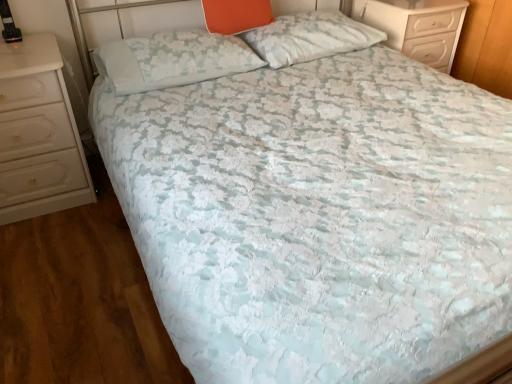
Where is `white textured pillow at upper center, the first pillow viewed from the right`? The height and width of the screenshot is (384, 512). white textured pillow at upper center, the first pillow viewed from the right is located at coordinates (309, 37).

The width and height of the screenshot is (512, 384). What do you see at coordinates (417, 27) in the screenshot? I see `white glossy chest of drawers at upper right, marked as the first chest of drawers in a top-to-bottom arrangement` at bounding box center [417, 27].

Where is `orange fabric pillow at upper center, arranged as the 2th pillow when viewed from the left`? orange fabric pillow at upper center, arranged as the 2th pillow when viewed from the left is located at coordinates point(236,15).

This screenshot has height=384, width=512. Identify the location of white textured pillow at upper center, which is counted as the 3th pillow, starting from the right. (173, 59).

Considering the sizes of objects white glossy chest of drawers at upper right, positioned as the second chest of drawers in left-to-right order, and white textured pillow at upper center, the first pillow viewed from the right, in the image provided, who is wider, white glossy chest of drawers at upper right, positioned as the second chest of drawers in left-to-right order, or white textured pillow at upper center, the first pillow viewed from the right,?

Wider between the two is white glossy chest of drawers at upper right, positioned as the second chest of drawers in left-to-right order.

Considering the positions of objects white glossy chest of drawers at upper right, arranged as the first chest of drawers when viewed from the right, and white textured pillow at upper center, the first pillow viewed from the right, in the image provided, who is more to the left, white glossy chest of drawers at upper right, arranged as the first chest of drawers when viewed from the right, or white textured pillow at upper center, the first pillow viewed from the right,?

Positioned to the left is white textured pillow at upper center, the first pillow viewed from the right.

At what (x,y) coordinates should I click in order to perform the action: click on the 1st pillow in front of the white glossy chest of drawers at upper right, positioned as the second chest of drawers in front-to-back order, starting your count from the anchor. Please return your answer as a coordinate pair (x, y). The image size is (512, 384). Looking at the image, I should click on (309, 37).

Are white glossy chest of drawers at upper right, arranged as the first chest of drawers when viewed from the right, and white textured pillow at upper center, the first pillow viewed from the right, far apart?

No, white glossy chest of drawers at upper right, arranged as the first chest of drawers when viewed from the right, is not far away from white textured pillow at upper center, the first pillow viewed from the right.

Does white glossy chest of drawers at upper right, arranged as the first chest of drawers when viewed from the right, contain white textured pillow at upper center, which is the 1th pillow in left-to-right order?

No, white textured pillow at upper center, which is the 1th pillow in left-to-right order, is located outside of white glossy chest of drawers at upper right, arranged as the first chest of drawers when viewed from the right.

In the scene shown: From the image's perspective, which one is positioned higher, white glossy chest of drawers at upper right, arranged as the first chest of drawers when viewed from the right, or white textured pillow at upper center, which is counted as the 3th pillow, starting from the right?

white glossy chest of drawers at upper right, arranged as the first chest of drawers when viewed from the right.

From a real-world perspective, which pillow is the 1st one above the white glossy chest of drawers at upper right, marked as the 2th chest of drawers in a bottom-to-top arrangement? Please provide its 2D coordinates.

[(173, 59)]

Can you confirm if white glossy chest of drawers at upper right, positioned as the second chest of drawers in left-to-right order, is wider than white textured pillow at upper center, which is counted as the 3th pillow, starting from the right?

Yes.

In the scene shown: Measure the distance between orange fabric pillow at upper center, which is the 2th pillow in right-to-left order, and white glossy chest of drawers at left, which is counted as the 2th chest of drawers, starting from the top.

They are 96.69 centimeters apart.

Considering the relative sizes of orange fabric pillow at upper center, arranged as the 2th pillow when viewed from the left, and white glossy chest of drawers at left, positioned as the 2th chest of drawers in back-to-front order, in the image provided, is orange fabric pillow at upper center, arranged as the 2th pillow when viewed from the left, taller than white glossy chest of drawers at left, positioned as the 2th chest of drawers in back-to-front order,?

Incorrect, the height of orange fabric pillow at upper center, arranged as the 2th pillow when viewed from the left, is not larger of that of white glossy chest of drawers at left, positioned as the 2th chest of drawers in back-to-front order.

From the image's perspective, which object appears higher, orange fabric pillow at upper center, which is the 2th pillow in right-to-left order, or white glossy chest of drawers at left, placed as the first chest of drawers when sorted from bottom to top?

orange fabric pillow at upper center, which is the 2th pillow in right-to-left order, from the image's perspective.

Is point (240, 24) more distant than point (55, 38)?

Yes.

Can you confirm if white glossy chest of drawers at left, placed as the first chest of drawers when sorted from bottom to top, is bigger than white glossy chest of drawers at upper right, placed as the 1th chest of drawers when sorted from back to front?

Indeed, white glossy chest of drawers at left, placed as the first chest of drawers when sorted from bottom to top, has a larger size compared to white glossy chest of drawers at upper right, placed as the 1th chest of drawers when sorted from back to front.

From a real-world perspective, is white glossy chest of drawers at left, arranged as the 1th chest of drawers when viewed from the front, physically located above or below white glossy chest of drawers at upper right, positioned as the second chest of drawers in front-to-back order?

Clearly, from a real-world perspective, white glossy chest of drawers at left, arranged as the 1th chest of drawers when viewed from the front, is below white glossy chest of drawers at upper right, positioned as the second chest of drawers in front-to-back order.

Does white glossy chest of drawers at left, positioned as the 2th chest of drawers in back-to-front order, have a greater height compared to white glossy chest of drawers at upper right, placed as the 1th chest of drawers when sorted from back to front?

Yes, white glossy chest of drawers at left, positioned as the 2th chest of drawers in back-to-front order, is taller than white glossy chest of drawers at upper right, placed as the 1th chest of drawers when sorted from back to front.

From the image's perspective, is white glossy chest of drawers at left, positioned as the 2th chest of drawers in back-to-front order, positioned above or below orange fabric pillow at upper center, which is the 2th pillow in right-to-left order?

Based on their image positions, white glossy chest of drawers at left, positioned as the 2th chest of drawers in back-to-front order, is located beneath orange fabric pillow at upper center, which is the 2th pillow in right-to-left order.

Is white glossy chest of drawers at left, placed as the first chest of drawers when sorted from left to right, not near orange fabric pillow at upper center, which is the 2th pillow in right-to-left order?

No, white glossy chest of drawers at left, placed as the first chest of drawers when sorted from left to right, is not far away from orange fabric pillow at upper center, which is the 2th pillow in right-to-left order.

Considering the positions of points (56, 184) and (217, 15), is point (56, 184) farther from camera compared to point (217, 15)?

No.

Does point (455, 15) come closer to viewer compared to point (15, 43)?

No, it is not.

Between white glossy chest of drawers at upper right, marked as the 2th chest of drawers in a bottom-to-top arrangement, and white glossy chest of drawers at left, positioned as the second chest of drawers in right-to-left order, which one has larger size?

white glossy chest of drawers at left, positioned as the second chest of drawers in right-to-left order.

Is white glossy chest of drawers at upper right, positioned as the second chest of drawers in front-to-back order, directly adjacent to white glossy chest of drawers at left, placed as the first chest of drawers when sorted from left to right?

No, white glossy chest of drawers at upper right, positioned as the second chest of drawers in front-to-back order, is not making contact with white glossy chest of drawers at left, placed as the first chest of drawers when sorted from left to right.

From the image's perspective, which one is positioned lower, white glossy chest of drawers at upper right, placed as the 1th chest of drawers when sorted from back to front, or white glossy chest of drawers at left, positioned as the second chest of drawers in right-to-left order?

From the image's view, white glossy chest of drawers at left, positioned as the second chest of drawers in right-to-left order, is below.

Between white glossy chest of drawers at left, which is counted as the 2th chest of drawers, starting from the top, and white textured pillow at upper center, which is the 1th pillow in left-to-right order, which one has smaller size?

Smaller between the two is white textured pillow at upper center, which is the 1th pillow in left-to-right order.

Is the position of white glossy chest of drawers at left, positioned as the 2th chest of drawers in back-to-front order, more distant than that of white textured pillow at upper center, which is counted as the 3th pillow, starting from the right?

No, it is in front of white textured pillow at upper center, which is counted as the 3th pillow, starting from the right.

Is white glossy chest of drawers at left, arranged as the 1th chest of drawers when viewed from the front, oriented away from white textured pillow at upper center, which is counted as the 3th pillow, starting from the right?

No.

Measure the distance from white glossy chest of drawers at left, which is counted as the 2th chest of drawers, starting from the top, to white textured pillow at upper center, which is the 1th pillow in left-to-right order.

white glossy chest of drawers at left, which is counted as the 2th chest of drawers, starting from the top, and white textured pillow at upper center, which is the 1th pillow in left-to-right order, are 18.50 inches apart.

This screenshot has width=512, height=384. Identify the location of chest of drawers on the right of white textured pillow at upper center, the 3th pillow viewed from the left. (417, 27).

What are the coordinates of `the 3rd pillow counting from the left of the white glossy chest of drawers at upper right, placed as the 1th chest of drawers when sorted from back to front` in the screenshot? It's located at (173, 59).

Estimate the real-world distances between objects in this image. Which object is further from white glossy chest of drawers at upper right, placed as the 1th chest of drawers when sorted from back to front, white textured pillow at upper center, which is counted as the 3th pillow, starting from the right, or white glossy chest of drawers at left, positioned as the 2th chest of drawers in back-to-front order?

white glossy chest of drawers at left, positioned as the 2th chest of drawers in back-to-front order, lies further to white glossy chest of drawers at upper right, placed as the 1th chest of drawers when sorted from back to front, than the other object.

Looking at the image, which one is located closer to orange fabric pillow at upper center, which is the 2th pillow in right-to-left order, white textured pillow at upper center, the first pillow viewed from the right, or white glossy chest of drawers at left, positioned as the second chest of drawers in right-to-left order?

Based on the image, white textured pillow at upper center, the first pillow viewed from the right, appears to be nearer to orange fabric pillow at upper center, which is the 2th pillow in right-to-left order.

Looking at the image, which one is located further to white textured pillow at upper center, which is the 1th pillow in left-to-right order, white glossy chest of drawers at upper right, arranged as the first chest of drawers when viewed from the right, or white glossy chest of drawers at left, placed as the first chest of drawers when sorted from left to right?

The object further to white textured pillow at upper center, which is the 1th pillow in left-to-right order, is white glossy chest of drawers at upper right, arranged as the first chest of drawers when viewed from the right.

Looking at the image, which one is located closer to white textured pillow at upper center, which is the 1th pillow in left-to-right order, orange fabric pillow at upper center, arranged as the 2th pillow when viewed from the left, or white glossy chest of drawers at left, placed as the first chest of drawers when sorted from left to right?

Based on the image, orange fabric pillow at upper center, arranged as the 2th pillow when viewed from the left, appears to be nearer to white textured pillow at upper center, which is the 1th pillow in left-to-right order.

Estimate the real-world distances between objects in this image. Which object is further from white textured pillow at upper center, which is counted as the 3th pillow, starting from the right, white glossy chest of drawers at left, positioned as the 2th chest of drawers in back-to-front order, or white textured pillow at upper center, the first pillow viewed from the right?

white glossy chest of drawers at left, positioned as the 2th chest of drawers in back-to-front order, is further to white textured pillow at upper center, which is counted as the 3th pillow, starting from the right.

Estimate the real-world distances between objects in this image. Which object is closer to white textured pillow at upper center, which is the 1th pillow in left-to-right order, orange fabric pillow at upper center, arranged as the 2th pillow when viewed from the left, or white textured pillow at upper center, the 3th pillow viewed from the left?

orange fabric pillow at upper center, arranged as the 2th pillow when viewed from the left, is closer to white textured pillow at upper center, which is the 1th pillow in left-to-right order.

Looking at the image, which one is located further to white glossy chest of drawers at left, placed as the first chest of drawers when sorted from left to right, white textured pillow at upper center, the 3th pillow viewed from the left, or white glossy chest of drawers at upper right, positioned as the second chest of drawers in front-to-back order?

white glossy chest of drawers at upper right, positioned as the second chest of drawers in front-to-back order, is further to white glossy chest of drawers at left, placed as the first chest of drawers when sorted from left to right.

From the image, which object appears to be nearer to white glossy chest of drawers at upper right, marked as the first chest of drawers in a top-to-bottom arrangement, white textured pillow at upper center, which is the 1th pillow in left-to-right order, or orange fabric pillow at upper center, arranged as the 2th pillow when viewed from the left?

orange fabric pillow at upper center, arranged as the 2th pillow when viewed from the left, is positioned closer to the anchor white glossy chest of drawers at upper right, marked as the first chest of drawers in a top-to-bottom arrangement.

The height and width of the screenshot is (384, 512). Find the location of `pillow situated between orange fabric pillow at upper center, arranged as the 2th pillow when viewed from the left, and white glossy chest of drawers at upper right, placed as the 1th chest of drawers when sorted from back to front, from left to right`. pillow situated between orange fabric pillow at upper center, arranged as the 2th pillow when viewed from the left, and white glossy chest of drawers at upper right, placed as the 1th chest of drawers when sorted from back to front, from left to right is located at coordinates (309, 37).

The image size is (512, 384). In order to click on pillow between white textured pillow at upper center, which is the 1th pillow in left-to-right order, and white textured pillow at upper center, the 3th pillow viewed from the left, in the horizontal direction in this screenshot , I will do `click(236, 15)`.

Find the location of a particular element. pillow between white glossy chest of drawers at left, placed as the first chest of drawers when sorted from bottom to top, and orange fabric pillow at upper center, arranged as the 2th pillow when viewed from the left, in the horizontal direction is located at coordinates (173, 59).